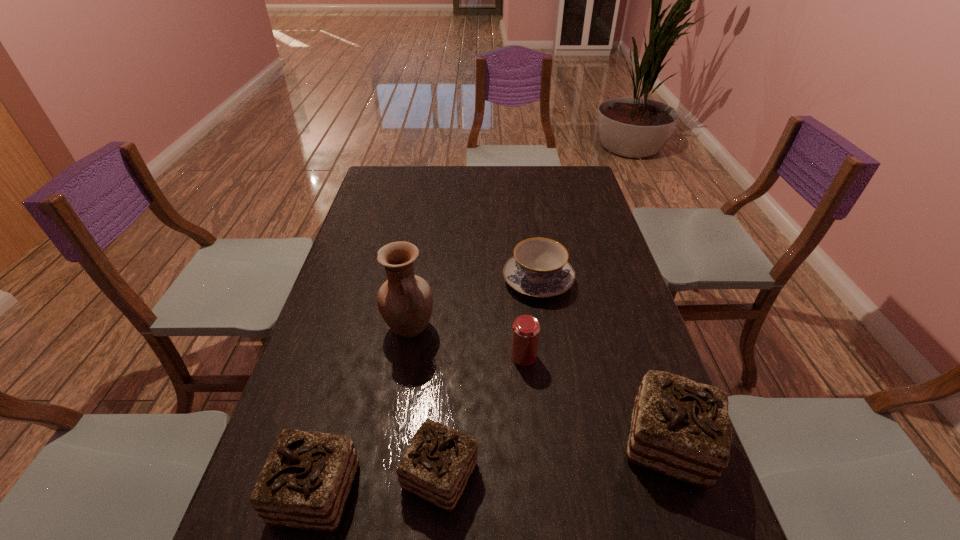
I want to click on vacant space at the near edge of the desktop, so click(482, 501).

Locate an element on the screen. This screenshot has width=960, height=540. vacant space at the left edge of the desktop is located at coordinates (385, 237).

The height and width of the screenshot is (540, 960). I want to click on vacant space at the right edge of the desktop, so click(x=588, y=215).

The image size is (960, 540). I want to click on empty location between the pottery and the farthest object, so click(x=473, y=304).

Locate an element on the screen. The image size is (960, 540). free space between the rightmost chocolate cake and the second shortest chocolate cake is located at coordinates coord(492,468).

The width and height of the screenshot is (960, 540). Identify the location of free spot between the pottery and the shortest chocolate cake. (425, 402).

At what (x,y) coordinates should I click in order to perform the action: click on free space between the rightmost object and the beer can. Please return your answer as a coordinate pair (x, y). Looking at the image, I should click on (596, 400).

Locate an element on the screen. This screenshot has width=960, height=540. free area in between the tallest object and the rightmost object is located at coordinates (539, 386).

Where is `free space between the leftmost chocolate cake and the beer can`? free space between the leftmost chocolate cake and the beer can is located at coordinates (420, 424).

Locate an element on the screen. unoccupied position between the second tallest chocolate cake and the pottery is located at coordinates (363, 410).